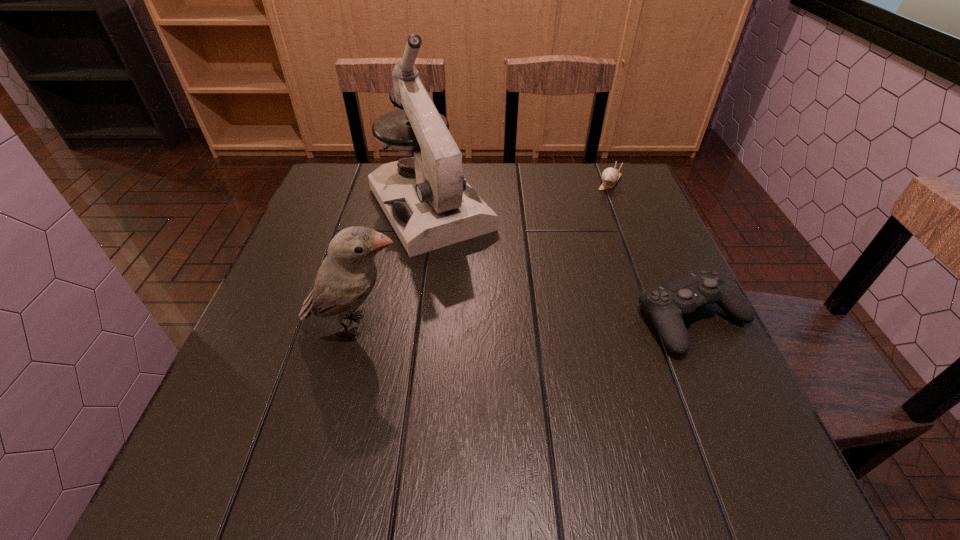
What are the coordinates of `vacant space located 0.390m on the shell of the shortest object` in the screenshot? It's located at coord(551,274).

Image resolution: width=960 pixels, height=540 pixels. I want to click on vacant space located 0.210m on the shell of the shortest object, so [x=579, y=231].

Identify the location of microscope at the far edge. Image resolution: width=960 pixels, height=540 pixels. (428, 202).

The image size is (960, 540). I want to click on escargot that is at the far edge, so click(610, 176).

This screenshot has height=540, width=960. I want to click on bird that is at the left edge, so click(347, 275).

The height and width of the screenshot is (540, 960). Find the location of `microscope that is at the left edge`. microscope that is at the left edge is located at coordinates (428, 202).

Where is `control that is at the right edge`? Image resolution: width=960 pixels, height=540 pixels. control that is at the right edge is located at coordinates pyautogui.click(x=666, y=304).

In order to click on escargot that is positioned at the right edge in this screenshot , I will do 610,176.

Where is `object present at the far left corner`? object present at the far left corner is located at coordinates (428, 202).

Identify the location of object that is at the far right corner. (610, 176).